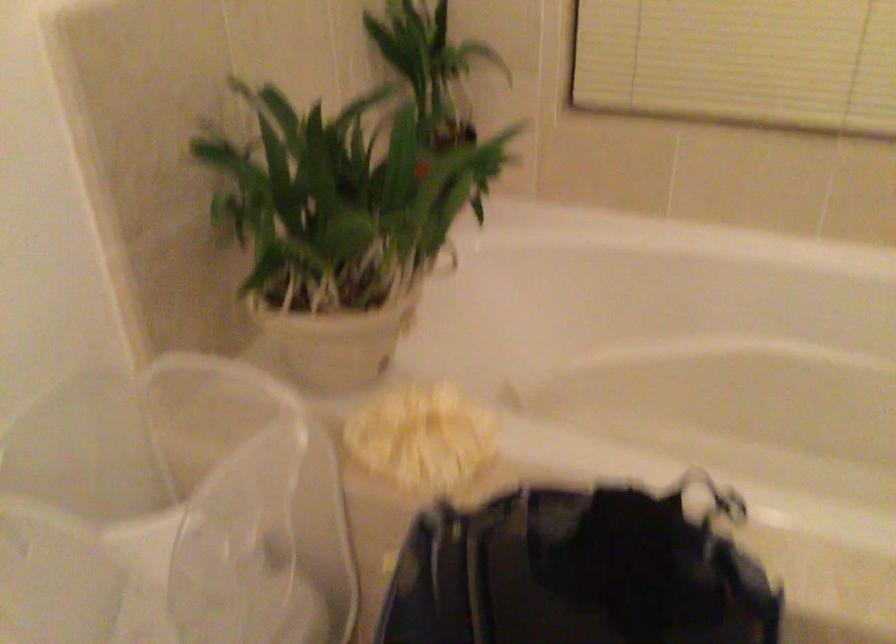
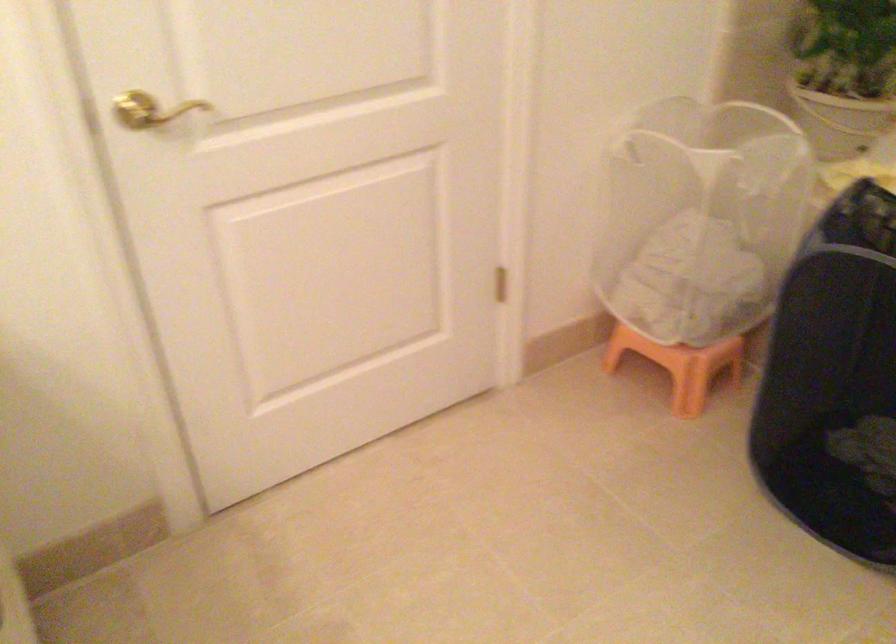
Question: How did the camera likely rotate?

Choices:
 (A) Left
 (B) Right
 (C) Up
 (D) Down

Answer: (A)